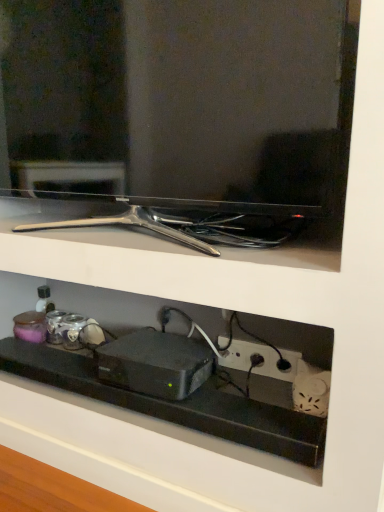
Question: Is point (309, 180) closer or farther from the camera than point (289, 357)?

Choices:
 (A) closer
 (B) farther

Answer: (A)

Question: Would you say matte black tv at upper center is to the left or to the right of black plastic power outlet at lower right in the picture?

Choices:
 (A) left
 (B) right

Answer: (A)

Question: Which is nearer to the black plastic power outlet at lower right?

Choices:
 (A) black plastic device at center
 (B) black plastic shelf at lower center
 (C) matte black tv at upper center

Answer: (A)

Question: Considering the real-world distances, which object is closest to the black plastic shelf at lower center?

Choices:
 (A) black plastic device at center
 (B) black plastic power outlet at lower right
 (C) matte black tv at upper center

Answer: (A)